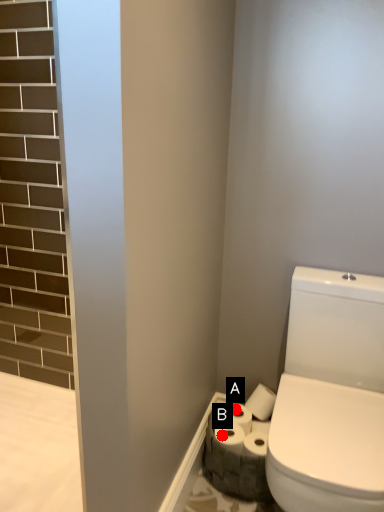
Question: Two points are circled on the image, labeled by A and B beside each circle. Which point is further to the camera?

Choices:
 (A) A is further
 (B) B is further

Answer: (A)